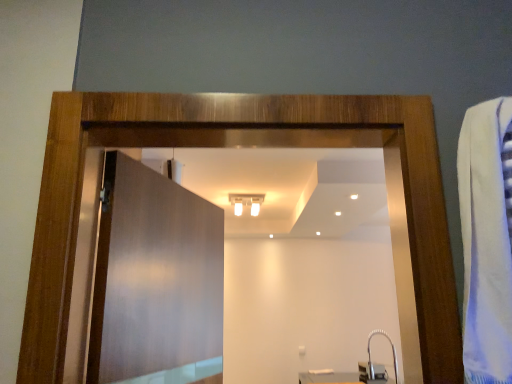
This screenshot has width=512, height=384. Identify the location of matte wood door at center. (155, 280).

This screenshot has width=512, height=384. Find the location of `matte wood door at center`. matte wood door at center is located at coordinates (155, 280).

Does satin nickel faucet at lower right appear on the left side of white glossy light fixture at upper center?

In fact, satin nickel faucet at lower right is to the right of white glossy light fixture at upper center.

Can you confirm if satin nickel faucet at lower right is shorter than white glossy light fixture at upper center?

No.

Is satin nickel faucet at lower right far from white glossy light fixture at upper center?

That's right, there is a large distance between satin nickel faucet at lower right and white glossy light fixture at upper center.

Do you think matte wood door at center is within satin nickel faucet at lower right, or outside of it?

matte wood door at center is not inside satin nickel faucet at lower right, it's outside.

Is matte wood door at center with satin nickel faucet at lower right?

No, matte wood door at center is not next to satin nickel faucet at lower right.

Based on the photo, can you tell me how much matte wood door at center and satin nickel faucet at lower right differ in facing direction?

The angular difference between matte wood door at center and satin nickel faucet at lower right is 160 degrees.

Is matte wood door at center bigger or smaller than satin nickel faucet at lower right?

Clearly, matte wood door at center is larger in size than satin nickel faucet at lower right.

Based on the photo, looking at their sizes, would you say satin nickel faucet at lower right is wider or thinner than matte wood door at center?

satin nickel faucet at lower right is wider than matte wood door at center.

From a real-world perspective, is satin nickel faucet at lower right beneath matte wood door at center?

Yes, from a real-world perspective, satin nickel faucet at lower right is under matte wood door at center.

Is satin nickel faucet at lower right looking in the opposite direction of matte wood door at center?

That's not correct — satin nickel faucet at lower right is not looking away from matte wood door at center.

Between point (165, 239) and point (244, 204), which one is positioned behind?

The point (244, 204) is more distant.

Does matte wood door at center have a lesser height compared to white glossy light fixture at upper center?

Incorrect, the height of matte wood door at center does not fall short of that of white glossy light fixture at upper center.

Where is `light fixture to the right of matte wood door at center`? light fixture to the right of matte wood door at center is located at coordinates (246, 202).

Would you say white glossy light fixture at upper center is part of matte wood door at center's contents?

No, white glossy light fixture at upper center is not a part of matte wood door at center.

From the image's perspective, is white glossy light fixture at upper center over satin nickel faucet at lower right?

Correct, white glossy light fixture at upper center appears higher than satin nickel faucet at lower right in the image.

Is white glossy light fixture at upper center outside of satin nickel faucet at lower right?

Yes, white glossy light fixture at upper center is not within satin nickel faucet at lower right.

Between white glossy light fixture at upper center and satin nickel faucet at lower right, which one has larger size?

white glossy light fixture at upper center.

Considering the relative sizes of white glossy light fixture at upper center and satin nickel faucet at lower right in the image provided, is white glossy light fixture at upper center thinner than satin nickel faucet at lower right?

In fact, white glossy light fixture at upper center might be wider than satin nickel faucet at lower right.

Who is more distant, white glossy light fixture at upper center or matte wood door at center?

white glossy light fixture at upper center is behind.

Which is behind, point (233, 205) or point (199, 367)?

The point (233, 205) is farther from the camera.

Looking at this image, is matte wood door at center completely or partially inside white glossy light fixture at upper center?

No, white glossy light fixture at upper center does not contain matte wood door at center.

From the image's perspective, who appears lower, white glossy light fixture at upper center or matte wood door at center?

matte wood door at center is shown below in the image.

What are the coordinates of `faucet in front of the white glossy light fixture at upper center` in the screenshot? It's located at (370, 354).

At what (x,y) coordinates should I click in order to perform the action: click on faucet that appears below the matte wood door at center (from the image's perspective). Please return your answer as a coordinate pair (x, y). This screenshot has height=384, width=512. Looking at the image, I should click on (370, 354).

Which object lies nearer to the anchor point matte wood door at center, white glossy light fixture at upper center or satin nickel faucet at lower right?

white glossy light fixture at upper center is positioned closer to the anchor matte wood door at center.

From the image, which object appears to be farther from satin nickel faucet at lower right, white glossy light fixture at upper center or matte wood door at center?

matte wood door at center.

Consider the image. Based on their spatial positions, is matte wood door at center or satin nickel faucet at lower right closer to white glossy light fixture at upper center?

The object closer to white glossy light fixture at upper center is satin nickel faucet at lower right.

From the image, which object appears to be nearer to white glossy light fixture at upper center, satin nickel faucet at lower right or matte wood door at center?

satin nickel faucet at lower right is positioned closer to the anchor white glossy light fixture at upper center.

When comparing their distances from satin nickel faucet at lower right, does matte wood door at center or white glossy light fixture at upper center seem further?

Based on the image, matte wood door at center appears to be further to satin nickel faucet at lower right.

Considering their positions, is satin nickel faucet at lower right positioned closer to matte wood door at center than white glossy light fixture at upper center?

white glossy light fixture at upper center lies closer to matte wood door at center than the other object.

Locate an element on the screen. This screenshot has width=512, height=384. faucet positioned between matte wood door at center and white glossy light fixture at upper center from near to far is located at coordinates (370, 354).